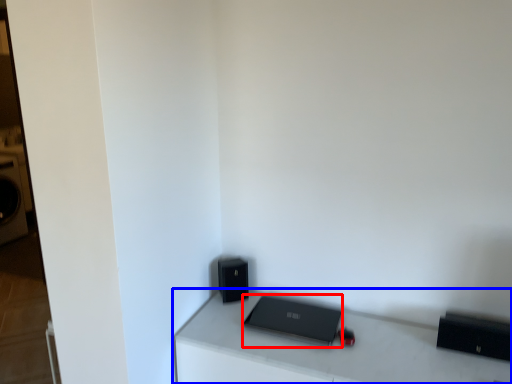
Question: Which point is further to the camera, laptop (highlighted by a red box) or furniture (highlighted by a blue box)?

Choices:
 (A) laptop
 (B) furniture

Answer: (A)